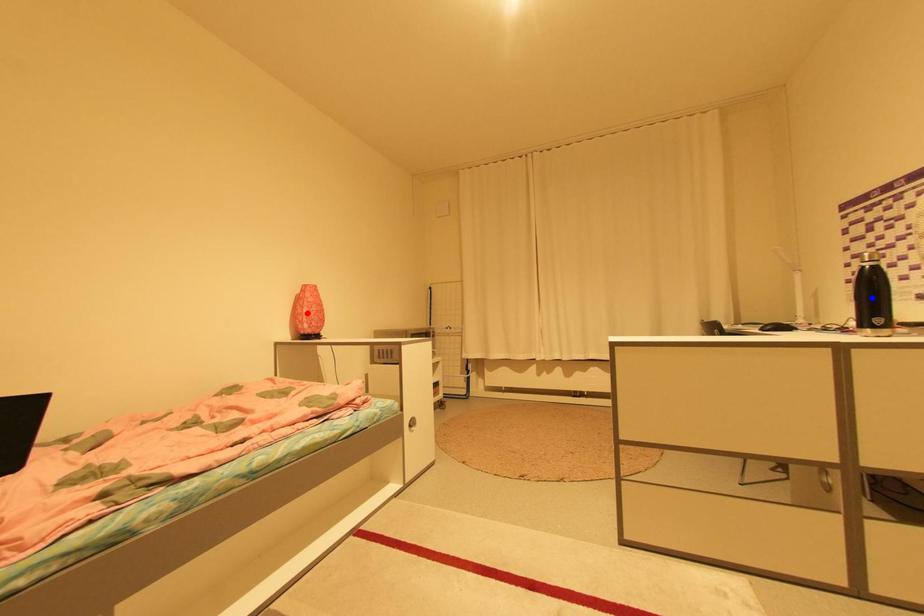
Question: Which of the two points in the image is closer to the camera?

Choices:
 (A) Blue point is closer.
 (B) Red point is closer.

Answer: (A)